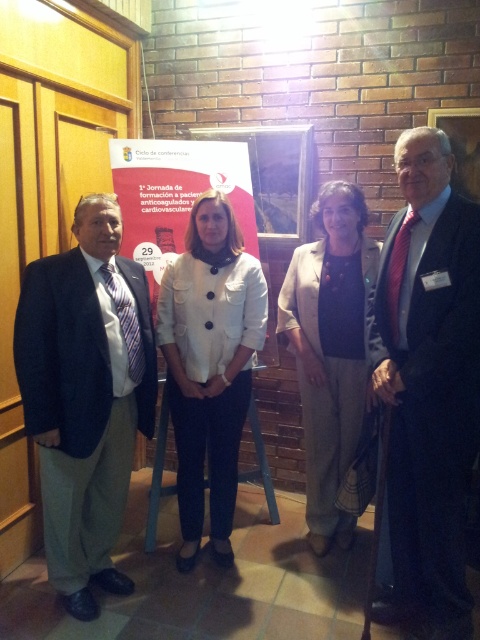
In the scene shown: You are a photographer taking a group photo of the dark blue suit at center and the beige woolen jacket at center. Which clothing item should you focus on first to ensure it is in the foreground?

The beige woolen jacket at center is positioned above the dark blue suit at center, so you should focus on the beige woolen jacket at center first to ensure it is in the foreground.

In the image, there are a dark blue suit at center and a matte white banner at center. Which object takes up more space in the scene?

The dark blue suit at center is larger in size than the matte white banner at center, so it takes up more space in the scene.